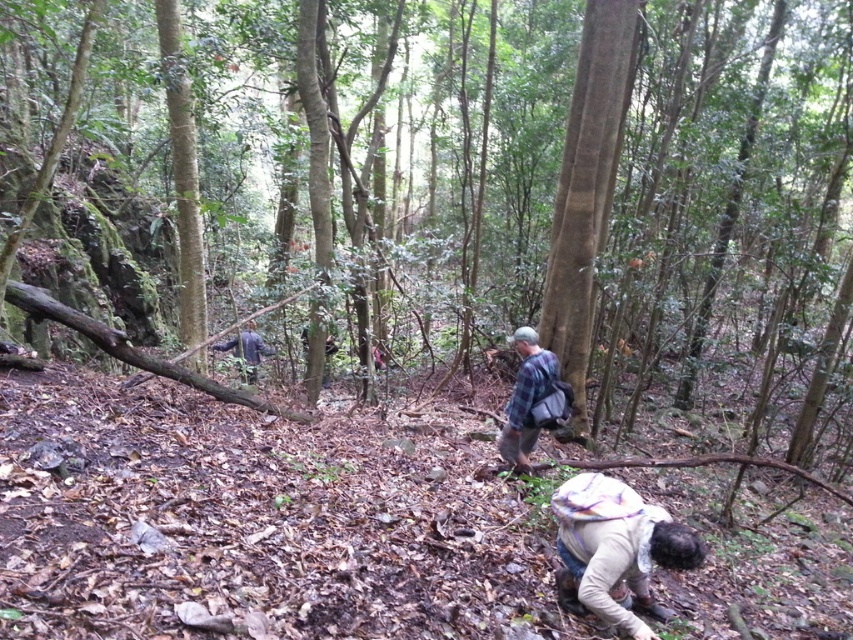
You are a hiker carrying a backpack and need to move between the brown rough tree at center and the brown rough bark tree at center. Can you walk through the space between them without needing to move any obstacles?

The distance between the brown rough tree at center and the brown rough bark tree at center is 5.15 meters, so yes, you can walk through the space between them without needing to move any obstacles since the gap is wide enough for a person to pass through comfortably.

You are a hiker who wants to place a 10 cm wide compass on the ground near the light beige fabric backpack at lower center. What coordinates should you use to place it?

The compass should be placed at coordinates near the light beige fabric backpack at lower center, which is located at point (616, 548).

You are a hiker carrying a light beige fabric backpack at lower center and want to take a photo of the brown rough tree at center. In which direction should you move to get the tree in your camera frame?

The brown rough tree at center is to the left of the light beige fabric backpack at lower center, so you should move to your right to position the tree within your camera frame.